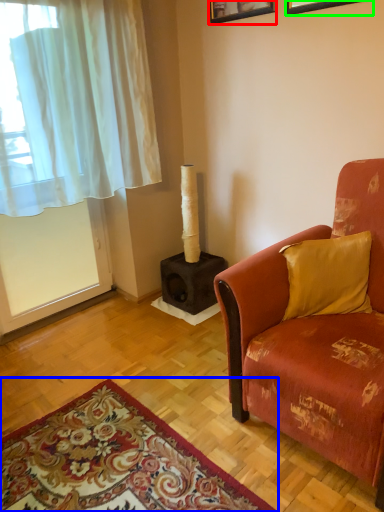
Question: Which object is the closest to the picture frame (highlighted by a red box)? Choose among these: mat (highlighted by a blue box) or picture frame (highlighted by a green box).

Choices:
 (A) mat
 (B) picture frame

Answer: (B)